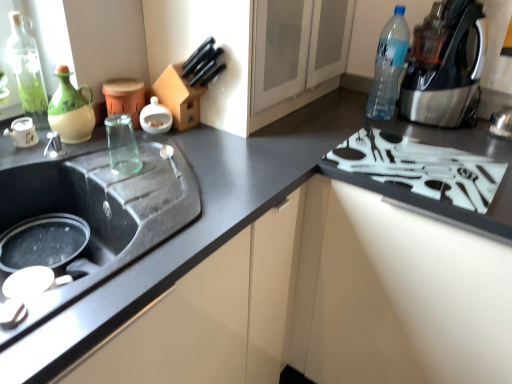
Identify the location of free spot to the left of stainless steel kettle at upper right, arranged as the 3th appliance when viewed from the left. (463, 126).